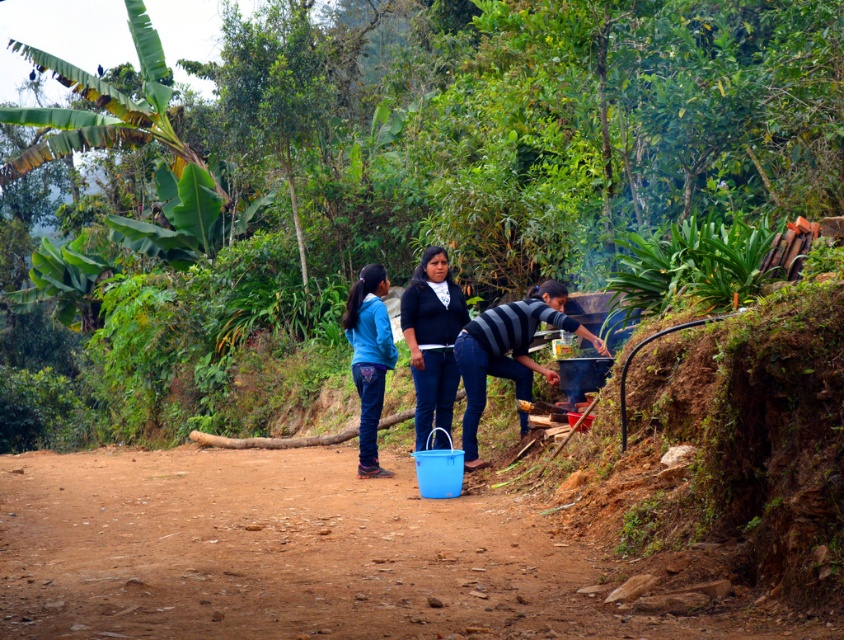
Is striped fabric person at right above matte black sweater at center?

No, striped fabric person at right is not above matte black sweater at center.

Does striped fabric person at right have a lesser width compared to matte black sweater at center?

In fact, striped fabric person at right might be wider than matte black sweater at center.

Find the location of `striped fabric person at right`. striped fabric person at right is located at coordinates (507, 349).

Can you confirm if brown dirt track at center is positioned to the right of matte black sweater at center?

No, brown dirt track at center is not to the right of matte black sweater at center.

Is brown dirt track at center bigger than matte black sweater at center?

Yes, brown dirt track at center is bigger than matte black sweater at center.

Is point (138, 625) closer to viewer compared to point (433, 257)?

Yes, it is.

The image size is (844, 640). What are the coordinates of `brown dirt track at center` in the screenshot? It's located at (306, 554).

Describe the element at coordinates (306, 554) in the screenshot. This screenshot has height=640, width=844. I see `brown dirt track at center` at that location.

Between point (14, 586) and point (560, 298), which one is positioned in front?

Point (14, 586) is more forward.

The image size is (844, 640). I want to click on brown dirt track at center, so click(306, 554).